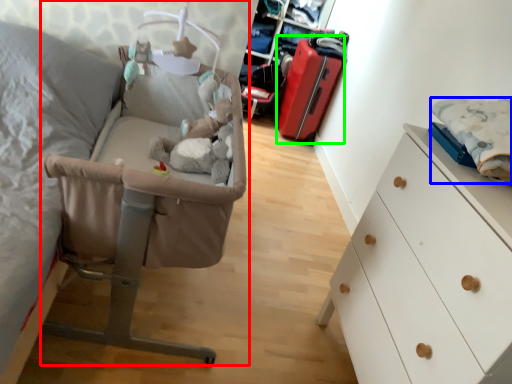
Question: Based on their relative distances, which object is nearer to infant bed (highlighted by a red box)? Choose from linen (highlighted by a blue box) and luggage (highlighted by a green box).

Choices:
 (A) linen
 (B) luggage

Answer: (A)